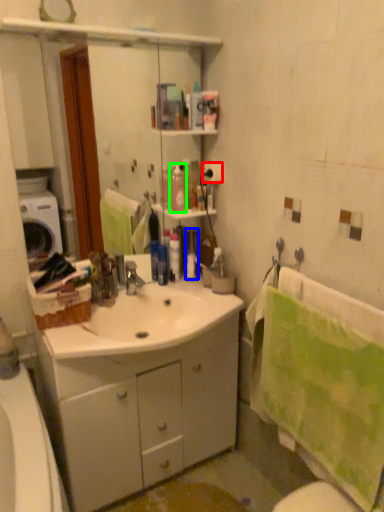
Question: Which object is positioned closest to toilet paper (highlighted by a red box)? Select from toiletry (highlighted by a blue box) and cleaning product (highlighted by a green box).

Choices:
 (A) toiletry
 (B) cleaning product

Answer: (B)